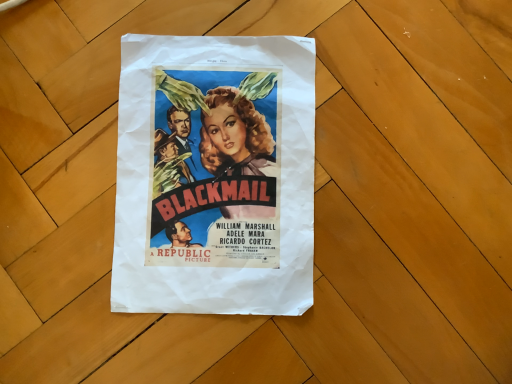
The width and height of the screenshot is (512, 384). What do you see at coordinates (215, 175) in the screenshot?
I see `matte paper poster at center` at bounding box center [215, 175].

The height and width of the screenshot is (384, 512). I want to click on matte paper poster at center, so click(x=215, y=175).

This screenshot has height=384, width=512. What are the coordinates of `matte paper poster at center` in the screenshot? It's located at (215, 175).